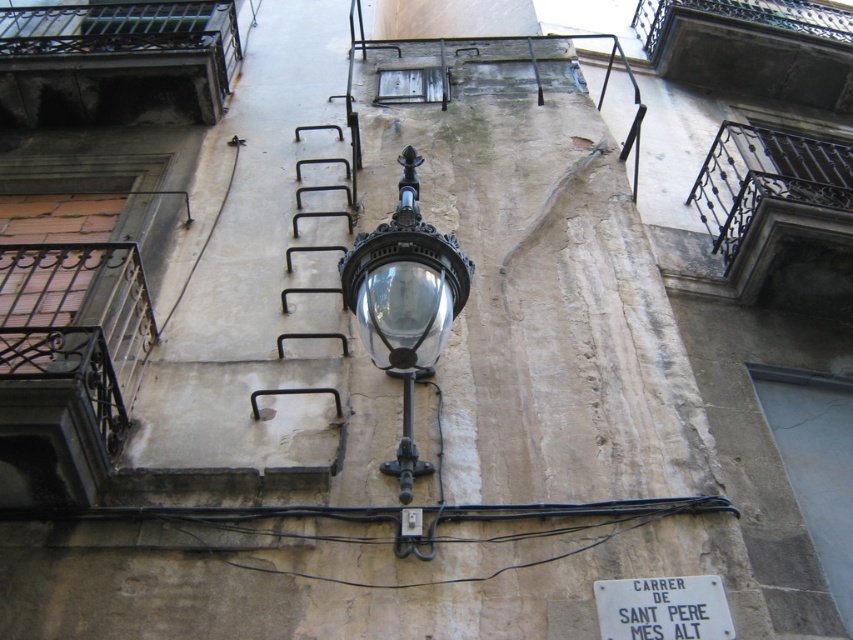
Question: Can you confirm if glossy glass lamp at upper center is positioned to the left of white matte sign at center?

Choices:
 (A) yes
 (B) no

Answer: (A)

Question: Which of the following is the farthest from the observer?

Choices:
 (A) (640, 621)
 (B) (434, 252)

Answer: (A)

Question: Is glossy glass lamp at upper center to the left of white matte sign at center from the viewer's perspective?

Choices:
 (A) no
 (B) yes

Answer: (B)

Question: Can you confirm if glossy glass lamp at upper center is positioned to the right of white matte sign at center?

Choices:
 (A) no
 (B) yes

Answer: (A)